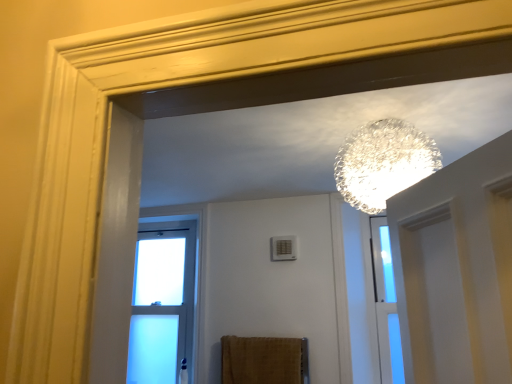
Question: Is clear glass sphere at upper center aimed at brown textured towel at lower center?

Choices:
 (A) no
 (B) yes

Answer: (A)

Question: Does clear glass sphere at upper center lie behind brown textured towel at lower center?

Choices:
 (A) yes
 (B) no

Answer: (B)

Question: Considering the relative sizes of clear glass sphere at upper center and brown textured towel at lower center in the image provided, is clear glass sphere at upper center wider than brown textured towel at lower center?

Choices:
 (A) yes
 (B) no

Answer: (A)

Question: Is clear glass sphere at upper center taller than brown textured towel at lower center?

Choices:
 (A) no
 (B) yes

Answer: (B)

Question: Does clear glass sphere at upper center lie in front of brown textured towel at lower center?

Choices:
 (A) no
 (B) yes

Answer: (B)

Question: Considering the relative positions of brown textured towel at lower center and clear glass sphere at upper center in the image provided, is brown textured towel at lower center to the left or to the right of clear glass sphere at upper center?

Choices:
 (A) left
 (B) right

Answer: (A)

Question: In terms of size, does brown textured towel at lower center appear bigger or smaller than clear glass sphere at upper center?

Choices:
 (A) big
 (B) small

Answer: (B)

Question: From a real-world perspective, relative to clear glass sphere at upper center, is brown textured towel at lower center vertically above or below?

Choices:
 (A) above
 (B) below

Answer: (B)

Question: Is brown textured towel at lower center wider or thinner than clear glass sphere at upper center?

Choices:
 (A) wide
 (B) thin

Answer: (B)

Question: Is clear glass window at center in front of or behind brown textured towel at lower center in the image?

Choices:
 (A) front
 (B) behind

Answer: (B)

Question: From their relative heights in the image, would you say clear glass window at center is taller or shorter than brown textured towel at lower center?

Choices:
 (A) tall
 (B) short

Answer: (A)

Question: Is point (168, 241) closer or farther from the camera than point (285, 354)?

Choices:
 (A) closer
 (B) farther

Answer: (B)

Question: From the image's perspective, is clear glass window at center located above or below brown textured towel at lower center?

Choices:
 (A) below
 (B) above

Answer: (B)

Question: From a real-world perspective, relative to clear glass window at center, is clear glass sphere at upper center vertically above or below?

Choices:
 (A) above
 (B) below

Answer: (A)

Question: Does point (373, 185) appear closer or farther from the camera than point (161, 259)?

Choices:
 (A) closer
 (B) farther

Answer: (A)